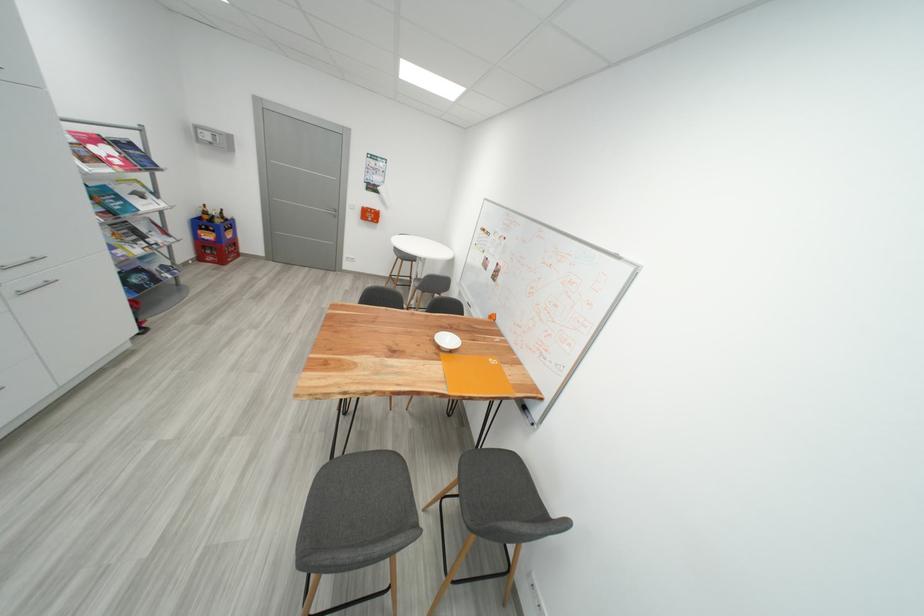
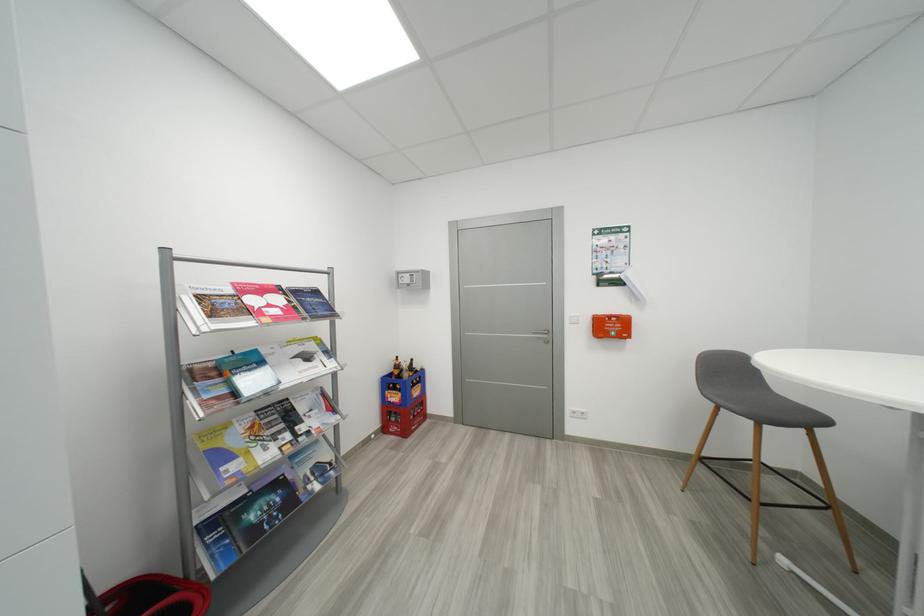
The point at (208, 261) is marked in the first image. Where is the corresponding point in the second image?

(392, 431)